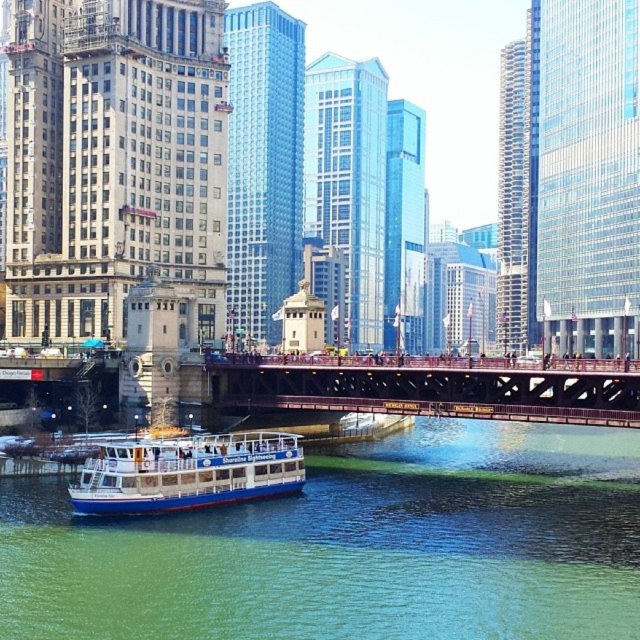
Is point (368, 580) closer to viewer compared to point (179, 452)?

Yes, point (368, 580) is in front of point (179, 452).

Is green water at lower left shorter than white glossy boat at lower center?

Yes, green water at lower left is shorter than white glossy boat at lower center.

Measure the distance between point [308,636] and camera.

Point [308,636] is 38.56 meters from camera.

Identify the location of green water at lower left. (355, 547).

Consider the image. Can you confirm if green water at lower left is positioned below brown metal bridge at center?

Yes, green water at lower left is below brown metal bridge at center.

Looking at this image, does green water at lower left appear on the right side of brown metal bridge at center?

In fact, green water at lower left is to the left of brown metal bridge at center.

Between point (525, 556) and point (636, 371), which one is positioned behind?

The point (636, 371) is more distant.

Identify the location of green water at lower left. (355, 547).

Who is more forward, (244, 394) or (189, 467)?

Positioned in front is point (189, 467).

Between brown metal bridge at center and white glossy boat at lower center, which one has less height?

white glossy boat at lower center is shorter.

Does point (616, 384) lie behind point (284, 444)?

Yes, point (616, 384) is behind point (284, 444).

Image resolution: width=640 pixels, height=640 pixels. I want to click on brown metal bridge at center, so click(x=428, y=388).